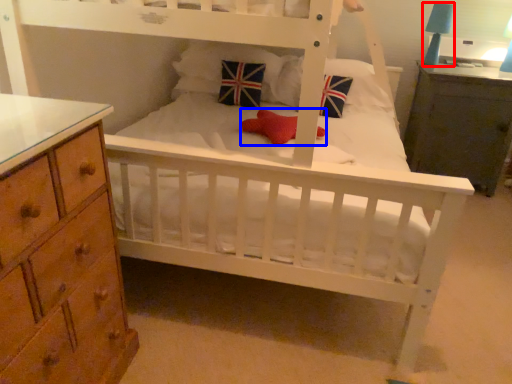
Question: Which point is closer to the camera, table lamp (highlighted by a red box) or toy (highlighted by a blue box)?

Choices:
 (A) table lamp
 (B) toy

Answer: (B)